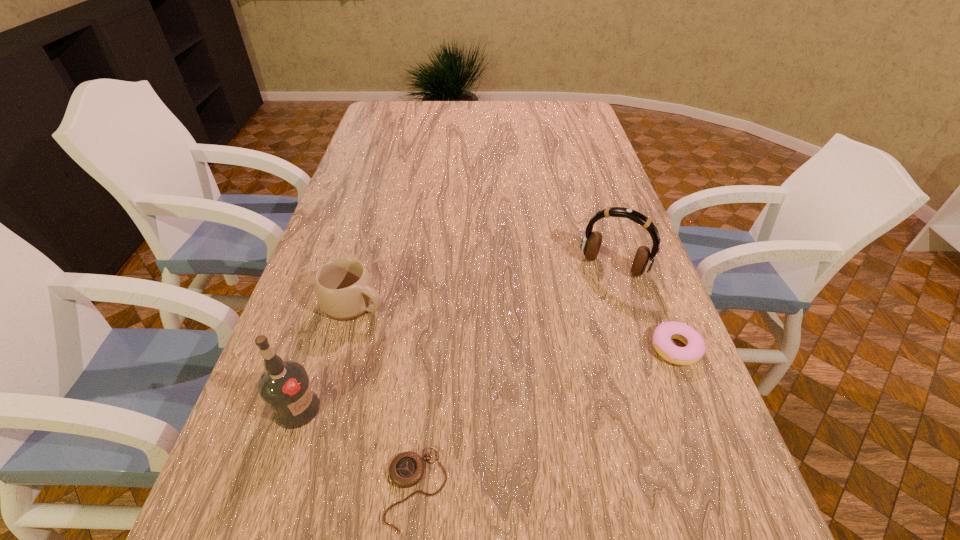
Find the location of `free spot on the desktop that is between the nearest object and the third farthest object and is positioned on the side of the fourth nearest object with the handle`. free spot on the desktop that is between the nearest object and the third farthest object and is positioned on the side of the fourth nearest object with the handle is located at coordinates (586, 396).

This screenshot has height=540, width=960. Identify the location of free space on the desktop that is between the third object from right to left and the doughnut and is positioned on the front label of the vodka. (548, 417).

Where is `free spot on the desktop that is between the third object from right to left and the doughnut and is positioned on the ear cup of the headset`? The height and width of the screenshot is (540, 960). free spot on the desktop that is between the third object from right to left and the doughnut and is positioned on the ear cup of the headset is located at coordinates (536, 423).